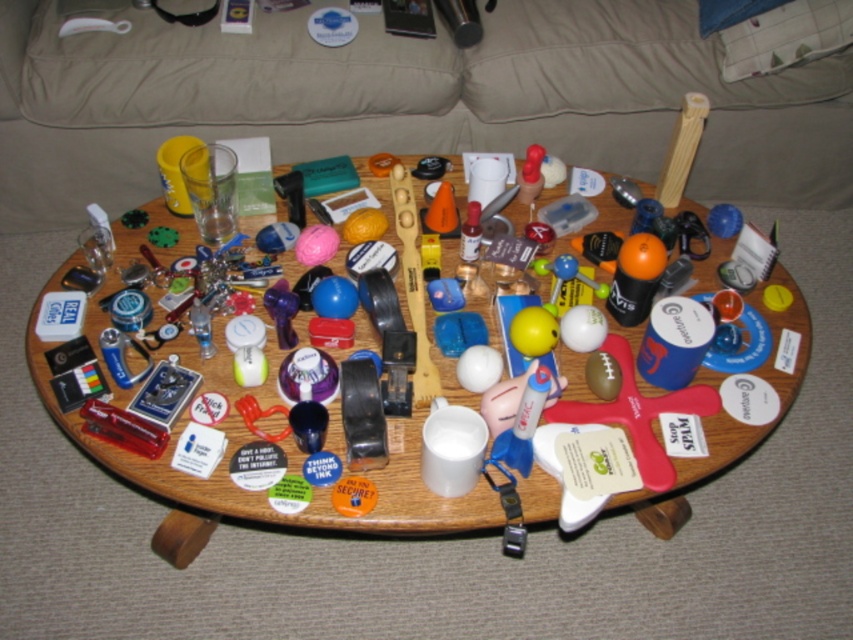
Question: Which point is closer to the camera?

Choices:
 (A) (148, 467)
 (B) (561, 141)

Answer: (A)

Question: Is beige fabric couch at upper center below wooden table at center?

Choices:
 (A) no
 (B) yes

Answer: (A)

Question: Which object is farther from the camera taking this photo?

Choices:
 (A) wooden table at center
 (B) beige fabric couch at upper center

Answer: (B)

Question: Is beige fabric couch at upper center thinner than wooden table at center?

Choices:
 (A) no
 (B) yes

Answer: (A)

Question: Does beige fabric couch at upper center lie behind wooden table at center?

Choices:
 (A) no
 (B) yes

Answer: (B)